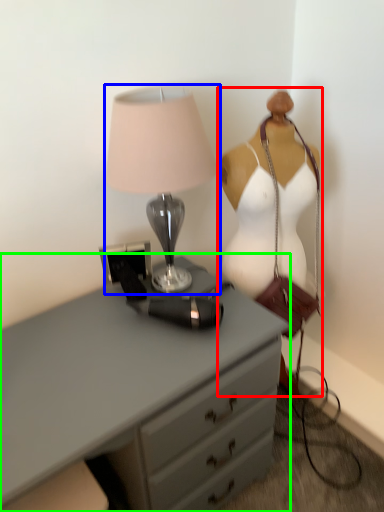
Question: Estimate the real-world distances between objects in this image. Which object is farther from mannequin (highlighted by a red box), lamp (highlighted by a blue box) or chest of drawers (highlighted by a green box)?

Choices:
 (A) lamp
 (B) chest of drawers

Answer: (B)